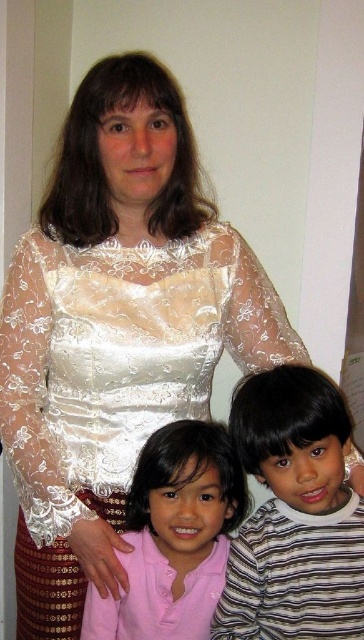
You are a photographer trying to capture a group photo of the three people in the scene. The adult in the center is wearing a white lace top with sheer sleeves and a patterned skirt with circular designs. The young boy on the right is wearing a horizontally striped shirt with alternating light and dark stripes. The young girl on the left is wearing a light pink button. You have a camera with a lens that has a maximum focus range of 40 inches. Can you focus on both the striped cotton shirt at lower center of

The striped cotton shirt at lower center is 38.40 inches away from the camera, which is within the maximum focus range of 40 inches. Therefore, the camera can focus on the striped cotton shirt at lower center.

Based on the scene description, where is the striped cotton shirt at lower center located in terms of coordinates?

The striped cotton shirt at lower center is located at coordinates point (294, 515).